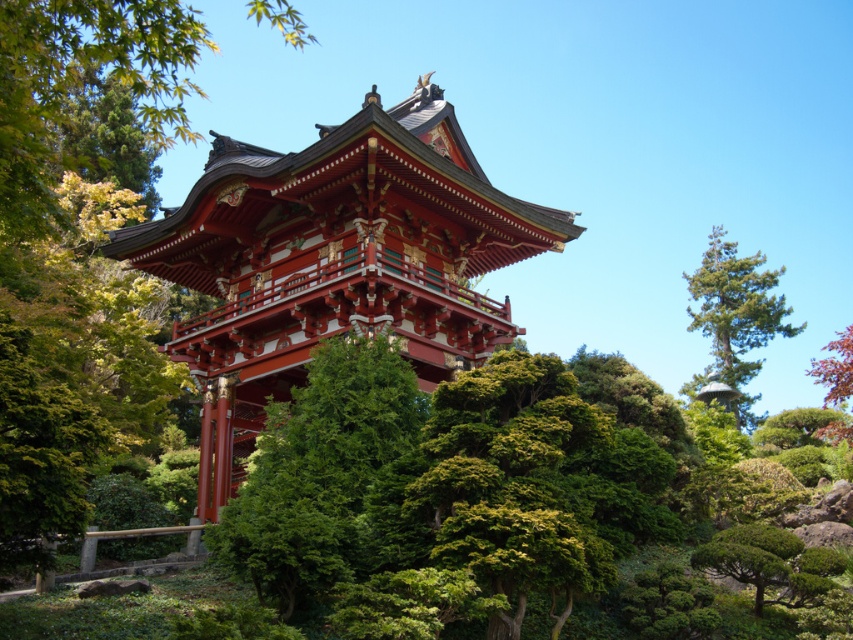
Does shiny lacquered pagoda at center appear under green leafy tree at upper left?

Yes.

Which is more to the left, shiny lacquered pagoda at center or green leafy tree at upper left?

Positioned to the left is green leafy tree at upper left.

The width and height of the screenshot is (853, 640). Describe the element at coordinates (334, 260) in the screenshot. I see `shiny lacquered pagoda at center` at that location.

You are a GUI agent. You are given a task and a screenshot of the screen. Output one action in this format:
    pyautogui.click(x=<x>, y=<y>)
    Task: Click on the shiny lacquered pagoda at center
    Image resolution: width=853 pixels, height=640 pixels.
    Given the screenshot: What is the action you would take?
    pyautogui.click(x=334, y=260)

Between green leafy tree at upper left and green textured pine tree at right, which one has less height?

With less height is green textured pine tree at right.

I want to click on green leafy tree at upper left, so click(83, 84).

Does point (167, 74) lie behind point (757, 323)?

No, (167, 74) is closer to viewer.

Image resolution: width=853 pixels, height=640 pixels. What are the coordinates of `green leafy tree at upper left` in the screenshot? It's located at (83, 84).

You are a GUI agent. You are given a task and a screenshot of the screen. Output one action in this format:
    pyautogui.click(x=<x>, y=<y>)
    Task: Click on the shiny lacquered pagoda at center
    Image resolution: width=853 pixels, height=640 pixels.
    Given the screenshot: What is the action you would take?
    pyautogui.click(x=334, y=260)

Where is `shiny lacquered pagoda at center`? The image size is (853, 640). shiny lacquered pagoda at center is located at coordinates (334, 260).